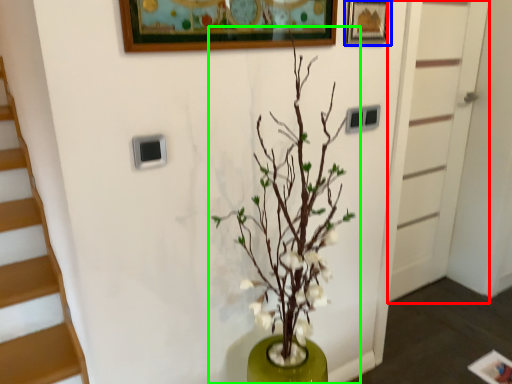
Question: Which object is positioned farthest from door (highlighted by a red box)? Select from picture frame (highlighted by a blue box) and houseplant (highlighted by a green box).

Choices:
 (A) picture frame
 (B) houseplant

Answer: (B)